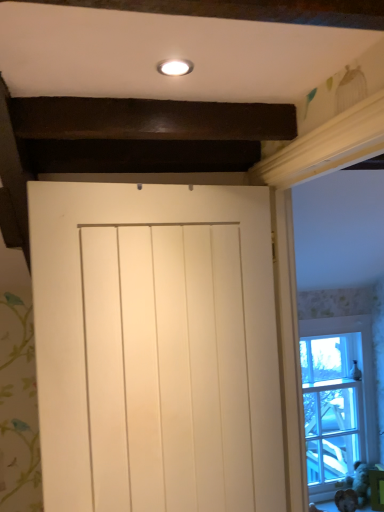
Describe the element at coordinates (340, 319) in the screenshot. This screenshot has height=512, width=384. I see `white painted wood at upper right` at that location.

This screenshot has height=512, width=384. What are the coordinates of `white matte door at center` in the screenshot? It's located at (156, 347).

You are a GUI agent. You are given a task and a screenshot of the screen. Output one action in this format:
    pyautogui.click(x=<x>, y=<y>)
    Task: Click on the clear glass window at right
    
    Given the screenshot: What is the action you would take?
    pyautogui.click(x=337, y=400)

In order to face brown furry animal at lower right, should I rotate leftwards or rightwards?

You should look right and rotate roughly 20.627 degrees.

The height and width of the screenshot is (512, 384). I want to click on white painted wood at upper right, so click(x=340, y=319).

Considering the relative positions of white matte door at center and brown furry animal at lower right in the image provided, is white matte door at center to the left or to the right of brown furry animal at lower right?

white matte door at center is positioned on brown furry animal at lower right's left side.

Between white matte door at center and brown furry animal at lower right, which one has larger width?

white matte door at center.

In the scene shown: Is clear glass window at right oriented away from white matte door at center?

No, clear glass window at right's orientation is not away from white matte door at center.

From the image's perspective, is clear glass window at right positioned above or below white matte door at center?

Clearly, from the image's perspective, clear glass window at right is below white matte door at center.

How distant is clear glass window at right from white matte door at center?

clear glass window at right is 1.57 meters from white matte door at center.

Is clear glass window at right to the left or to the right of white matte door at center in the image?

Based on their positions, clear glass window at right is located to the right of white matte door at center.

Could you tell me if white painted wood at upper right is facing clear glass window at right?

No, white painted wood at upper right is not aimed at clear glass window at right.

From a real-world perspective, is white painted wood at upper right above or below clear glass window at right?

In terms of real-world spatial position, white painted wood at upper right is above clear glass window at right.

Is white painted wood at upper right not inside clear glass window at right?

Yes, white painted wood at upper right is not within clear glass window at right.

Between white painted wood at upper right and clear glass window at right, which one has smaller size?

Smaller between the two is clear glass window at right.

From a real-world perspective, which object stands above the other?

white matte door at center, from a real-world perspective.

Is point (246, 439) closer to camera compared to point (319, 470)?

Yes, it is.

Considering the positions of objects white matte door at center and clear glass window at right in the image provided, who is behind, white matte door at center or clear glass window at right?

clear glass window at right is behind.

Is white matte door at center at the left side of white painted wood at upper right?

Yes.

Is white matte door at center smaller than white painted wood at upper right?

Yes, white matte door at center is smaller than white painted wood at upper right.

Is point (83, 486) positioned before point (380, 179)?

Yes.

From the image's perspective, is white painted wood at upper right located beneath white matte door at center?

Incorrect, from the image's perspective, white painted wood at upper right is higher than white matte door at center.

From a real-world perspective, between white painted wood at upper right and white matte door at center, who is vertically higher?

white painted wood at upper right.

Considering the relative sizes of white painted wood at upper right and white matte door at center in the image provided, is white painted wood at upper right taller than white matte door at center?

Yes.

Which object is positioned more to the left, white painted wood at upper right or white matte door at center?

white matte door at center.

How different are the orientations of white painted wood at upper right and brown furry animal at lower right in degrees?

83.8 degrees.

Is brown furry animal at lower right completely or partially inside white painted wood at upper right?

That's incorrect, brown furry animal at lower right is not inside white painted wood at upper right.

Looking at this image, does white painted wood at upper right have a lesser width compared to brown furry animal at lower right?

In fact, white painted wood at upper right might be wider than brown furry animal at lower right.

In order to click on animal on the right of white painted wood at upper right in this screenshot , I will do `click(346, 500)`.

Find the location of `animal that appears below the white matte door at center (from a real-world perspective)`. animal that appears below the white matte door at center (from a real-world perspective) is located at coordinates (346, 500).

Where is `door that appears in front of the clear glass window at right`? The width and height of the screenshot is (384, 512). door that appears in front of the clear glass window at right is located at coordinates (156, 347).

When comparing their distances from clear glass window at right, does brown furry animal at lower right or white matte door at center seem further?

The object further to clear glass window at right is white matte door at center.

Based on their spatial positions, is white matte door at center or clear glass window at right closer to brown furry animal at lower right?

Based on the image, clear glass window at right appears to be nearer to brown furry animal at lower right.

Looking at the image, which one is located closer to clear glass window at right, brown furry animal at lower right or white painted wood at upper right?

Among the two, white painted wood at upper right is located nearer to clear glass window at right.

Looking at the image, which one is located further to white matte door at center, brown furry animal at lower right or clear glass window at right?

Based on the image, brown furry animal at lower right appears to be further to white matte door at center.

Estimate the real-world distances between objects in this image. Which object is closer to white painted wood at upper right, brown furry animal at lower right or white matte door at center?

Based on the image, brown furry animal at lower right appears to be nearer to white painted wood at upper right.

Considering their positions, is white matte door at center positioned closer to clear glass window at right than brown furry animal at lower right?

brown furry animal at lower right.

Considering their positions, is brown furry animal at lower right positioned further to white painted wood at upper right than clear glass window at right?

brown furry animal at lower right lies further to white painted wood at upper right than the other object.

Consider the image. Estimate the real-world distances between objects in this image. Which object is further from brown furry animal at lower right, white painted wood at upper right or white matte door at center?

white matte door at center lies further to brown furry animal at lower right than the other object.

Locate an element on the screen. The width and height of the screenshot is (384, 512). animal between white painted wood at upper right and clear glass window at right from front to back is located at coordinates (346, 500).

Image resolution: width=384 pixels, height=512 pixels. I want to click on door located between white painted wood at upper right and clear glass window at right in the depth direction, so click(x=156, y=347).

Identify the location of door positioned between white painted wood at upper right and brown furry animal at lower right from near to far. (156, 347).

This screenshot has width=384, height=512. Find the location of `animal located between white matte door at center and clear glass window at right in the depth direction`. animal located between white matte door at center and clear glass window at right in the depth direction is located at coordinates (346, 500).